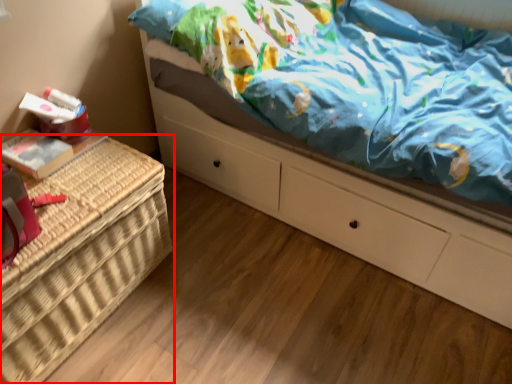
Question: Where is furniture (annotated by the red box) located in relation to bed in the image?

Choices:
 (A) right
 (B) left

Answer: (B)